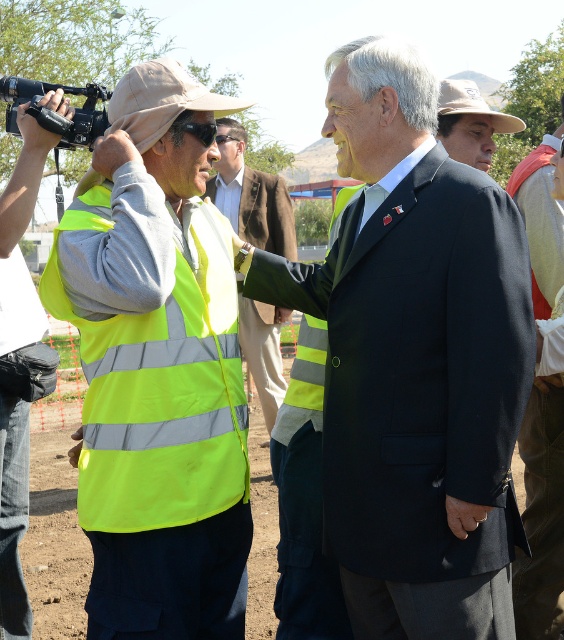
Which is behind, point (396, 268) or point (76, 113)?

Point (76, 113)

Looking at this image, which of these two, black suit at center or black plastic video camera at upper left, stands shorter?

black plastic video camera at upper left is shorter.

Is point (465, 461) positioned before point (86, 124)?

Yes, point (465, 461) is in front of point (86, 124).

Where is `black suit at center`? This screenshot has width=564, height=640. black suit at center is located at coordinates (415, 360).

In the scene shown: Is reflective yellow vest at center in front of khaki fabric hat at center?

No, reflective yellow vest at center is further to the viewer.

Is reflective yellow vest at center smaller than khaki fabric hat at center?

Actually, reflective yellow vest at center might be larger than khaki fabric hat at center.

The height and width of the screenshot is (640, 564). What are the coordinates of `reflective yellow vest at center` in the screenshot? It's located at (250, 195).

Who is positioned more to the left, high-visibility fabric safety vest at left or black plastic video camera at upper left?

black plastic video camera at upper left

You are a GUI agent. You are given a task and a screenshot of the screen. Output one action in this format:
    pyautogui.click(x=<x>, y=<y>)
    Task: Click on the high-visibility fabric safety vest at left
    This screenshot has height=640, width=564.
    Given the screenshot: What is the action you would take?
    pyautogui.click(x=160, y=387)